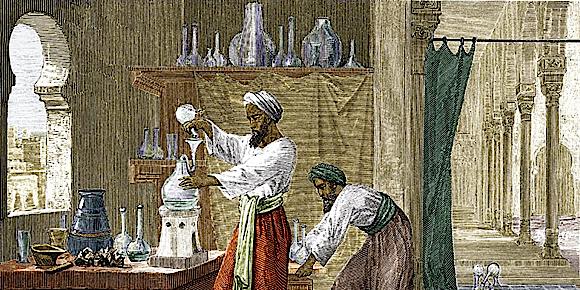
You are a GUI agent. You are given a task and a screenshot of the screen. Output one action in this format:
    pyautogui.click(x=<x>, y=<y>)
    Task: Click on the columns
    Image resolution: width=580 pixels, height=290 pixels.
    Given the screenshot: What is the action you would take?
    pyautogui.click(x=529, y=160), pyautogui.click(x=552, y=160), pyautogui.click(x=508, y=163)